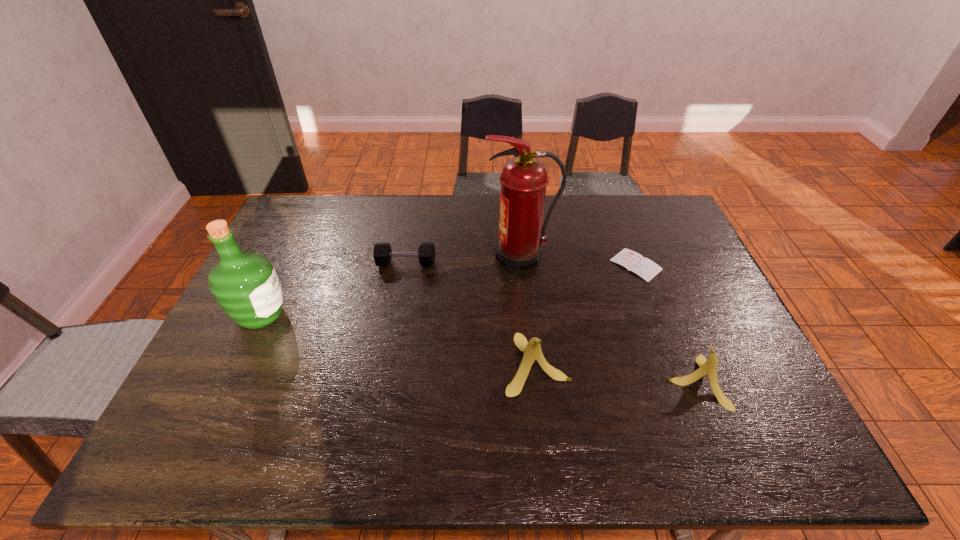
Find the location of a particular element. vacant spot to place a banana on the left is located at coordinates (388, 346).